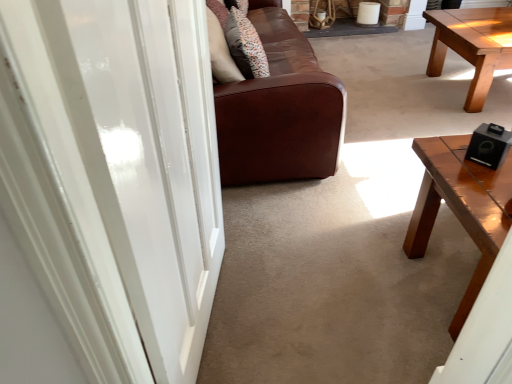
At what (x,y) coordinates should I click in order to perform the action: click on shiny brown wood coffee table at right. Please return your answer as a coordinate pair (x, y). The height and width of the screenshot is (384, 512). Looking at the image, I should click on (461, 207).

In order to click on patterned fabric pillow at center in this screenshot , I will do point(245,42).

Based on their positions, is black matte speaker at right located to the left or right of shiny brown wood coffee table at right?

black matte speaker at right is to the left of shiny brown wood coffee table at right.

Does black matte speaker at right have a greater height compared to shiny brown wood coffee table at right?

Incorrect, the height of black matte speaker at right is not larger of that of shiny brown wood coffee table at right.

Consider the image. From the image's perspective, is black matte speaker at right positioned above or below shiny brown wood coffee table at right?

From the image's perspective, black matte speaker at right appears above shiny brown wood coffee table at right.

Based on the photo, between black matte speaker at right and shiny brown wood coffee table at right, which one has smaller width?

black matte speaker at right.

Is shiny brown wood coffee table at right bigger or smaller than patterned fabric pillow at center?

Clearly, shiny brown wood coffee table at right is larger in size than patterned fabric pillow at center.

Would you consider shiny brown wood coffee table at right to be distant from patterned fabric pillow at center?

Yes, shiny brown wood coffee table at right is far from patterned fabric pillow at center.

Does point (485, 213) come closer to viewer compared to point (237, 14)?

Yes, point (485, 213) is closer to viewer.

From a real-world perspective, is black matte speaker at right under white glossy door at center?

Yes, from a real-world perspective, black matte speaker at right is below white glossy door at center.

Which of these two, black matte speaker at right or white glossy door at center, stands shorter?

With less height is black matte speaker at right.

Is black matte speaker at right positioned far away from white glossy door at center?

black matte speaker at right is positioned a significant distance from white glossy door at center.

Could white glossy door at center be considered to be inside black matte speaker at right?

No, black matte speaker at right does not contain white glossy door at center.

From a real-world perspective, which object rests below the other?

shiny brown wood coffee table at right, from a real-world perspective.

Is the surface of patterned fabric pillow at center in direct contact with shiny brown wood coffee table at right?

There is a gap between patterned fabric pillow at center and shiny brown wood coffee table at right.

Considering the sizes of patterned fabric pillow at center and shiny brown wood coffee table at right in the image, is patterned fabric pillow at center wider or thinner than shiny brown wood coffee table at right?

In the image, patterned fabric pillow at center appears to be more narrow than shiny brown wood coffee table at right.

Considering the points (227, 34) and (445, 160), which point is behind, point (227, 34) or point (445, 160)?

The point (227, 34) is farther.

Can you confirm if black matte speaker at right is smaller than patterned fabric pillow at center?

Correct, black matte speaker at right occupies less space than patterned fabric pillow at center.

Considering the sizes of objects black matte speaker at right and patterned fabric pillow at center in the image provided, who is taller, black matte speaker at right or patterned fabric pillow at center?

Standing taller between the two is patterned fabric pillow at center.

Based on the photo, would you say black matte speaker at right is outside patterned fabric pillow at center?

Indeed, black matte speaker at right is completely outside patterned fabric pillow at center.

Which is behind, point (489, 136) or point (227, 32)?

Positioned behind is point (227, 32).

Is point (258, 61) less distant than point (489, 150)?

No, it is behind (489, 150).

In terms of size, does patterned fabric pillow at center appear bigger or smaller than black matte speaker at right?

In the image, patterned fabric pillow at center appears to be larger than black matte speaker at right.

Could black matte speaker at right be considered to be inside patterned fabric pillow at center?

Result: Actually, black matte speaker at right is outside patterned fabric pillow at center.

Is shiny brown wood coffee table at right to the right of brown leather couch at center from the viewer's perspective?

Yes, shiny brown wood coffee table at right is to the right of brown leather couch at center.

In terms of size, does shiny brown wood coffee table at right appear bigger or smaller than brown leather couch at center?

In the image, shiny brown wood coffee table at right appears to be smaller than brown leather couch at center.

From the image's perspective, would you say shiny brown wood coffee table at right is positioned over brown leather couch at center?

No, from the image's perspective, shiny brown wood coffee table at right is not over brown leather couch at center.

Find the location of a particular element. The height and width of the screenshot is (384, 512). coffee table located on the right of black matte speaker at right is located at coordinates (461, 207).

At what (x,y) coordinates should I click in order to perform the action: click on coffee table located below the patterned fabric pillow at center (from the image's perspective). Please return your answer as a coordinate pair (x, y). The height and width of the screenshot is (384, 512). Looking at the image, I should click on (461, 207).

Based on the photo, considering their positions, is white glossy door at center positioned further to brown leather couch at center than black matte speaker at right?

white glossy door at center lies further to brown leather couch at center than the other object.

When comparing their distances from shiny brown wood coffee table at right, does patterned fabric pillow at center or white glossy door at center seem closer?

white glossy door at center is closer to shiny brown wood coffee table at right.

Considering their positions, is black matte speaker at right positioned closer to patterned fabric pillow at center than shiny brown wood coffee table at right?

shiny brown wood coffee table at right is positioned closer to the anchor patterned fabric pillow at center.

Estimate the real-world distances between objects in this image. Which object is closer to brown leather couch at center, white glossy door at center or patterned fabric pillow at center?

patterned fabric pillow at center lies closer to brown leather couch at center than the other object.

Looking at the image, which one is located further to patterned fabric pillow at center, white glossy door at center or shiny brown wood coffee table at right?

white glossy door at center lies further to patterned fabric pillow at center than the other object.

When comparing their distances from black matte speaker at right, does shiny brown wood coffee table at right or white glossy door at center seem closer?

shiny brown wood coffee table at right.

Estimate the real-world distances between objects in this image. Which object is further from black matte speaker at right, shiny brown wood coffee table at right or patterned fabric pillow at center?

patterned fabric pillow at center is further to black matte speaker at right.

Looking at the image, which one is located closer to white glossy door at center, patterned fabric pillow at center or shiny brown wood coffee table at right?

shiny brown wood coffee table at right lies closer to white glossy door at center than the other object.

The image size is (512, 384). In order to click on speaker between white glossy door at center and brown leather couch at center from front to back in this screenshot , I will do `click(489, 145)`.

You are a GUI agent. You are given a task and a screenshot of the screen. Output one action in this format:
    pyautogui.click(x=<x>, y=<y>)
    Task: Click on the speaker positioned between white glossy door at center and patterned fabric pillow at center from near to far
    This screenshot has height=384, width=512.
    Given the screenshot: What is the action you would take?
    pyautogui.click(x=489, y=145)

The height and width of the screenshot is (384, 512). I want to click on pillow between brown leather couch at center and shiny brown wood coffee table at right vertically, so click(245, 42).

Find the location of a particular element. The width and height of the screenshot is (512, 384). speaker between white glossy door at center and shiny brown wood coffee table at right is located at coordinates (489, 145).